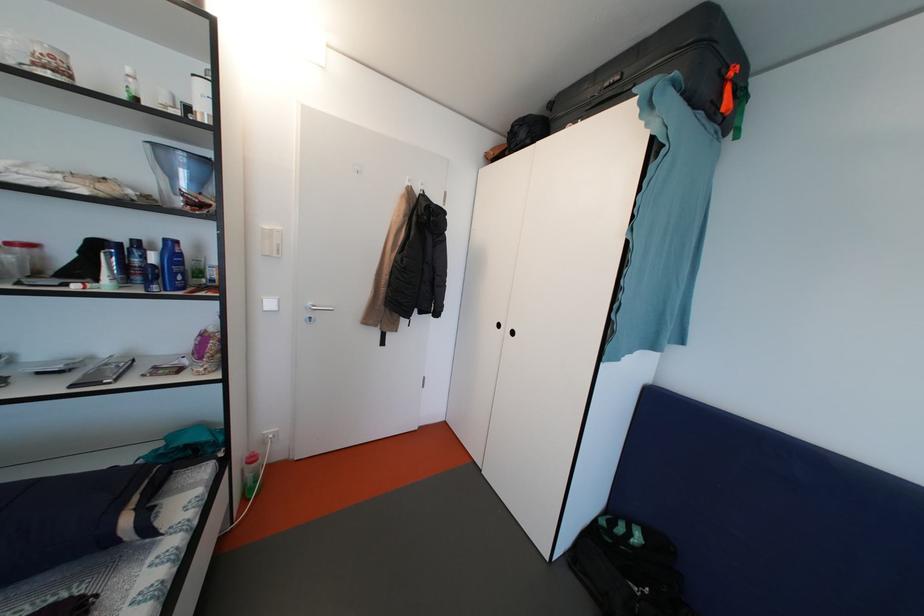
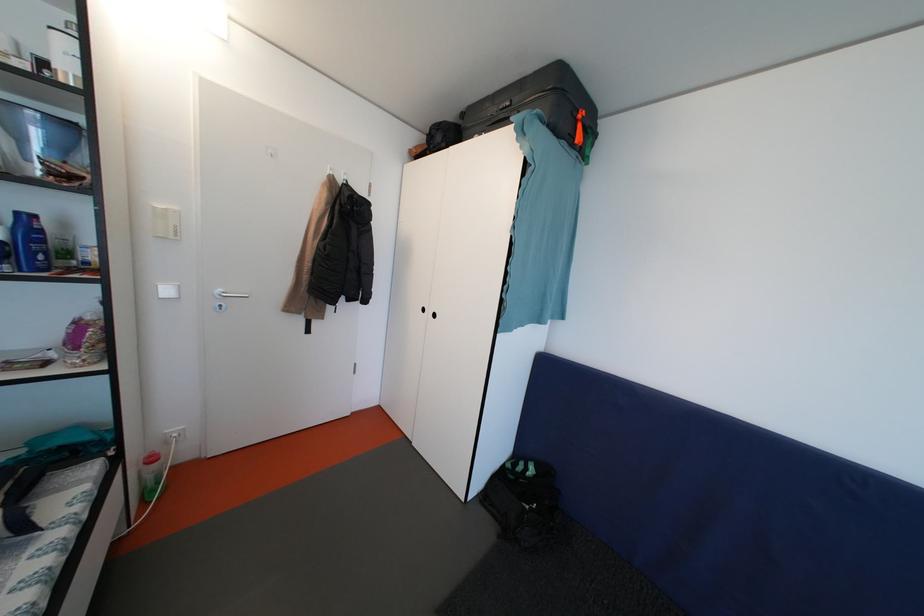
Where in the second image is the point corresponding to pixel 638 538 from the first image?

(533, 474)